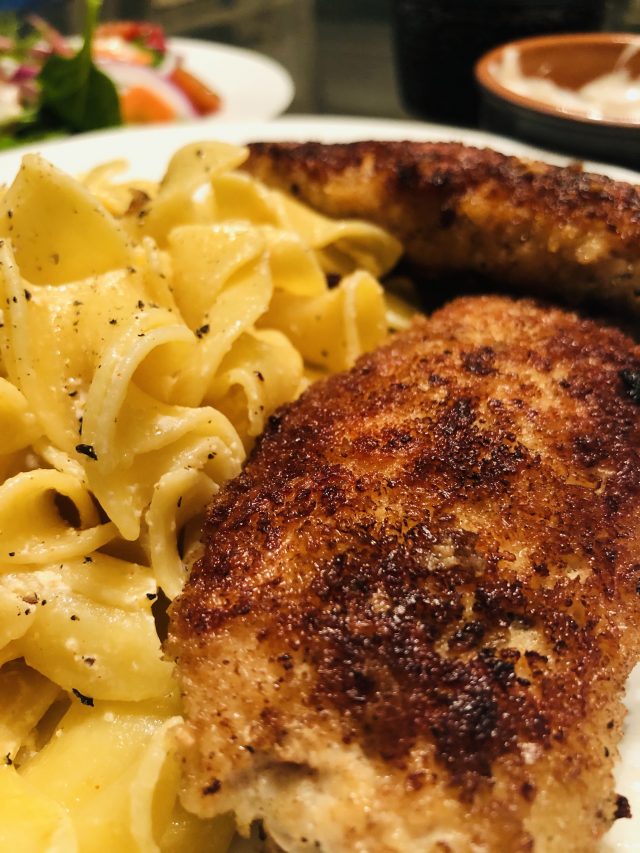
The image size is (640, 853). I want to click on surface of table or counter, so click(349, 61).